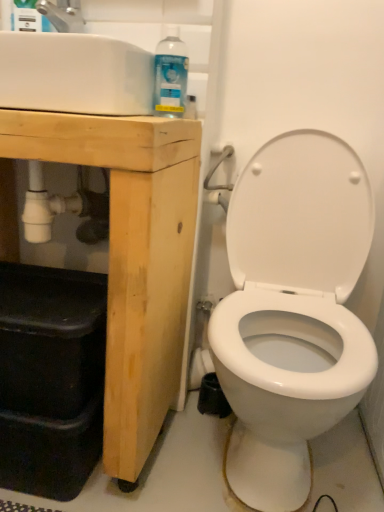
Question: From a real-world perspective, is brushed metal faucet at upper left positioned above or below natural wood cabinet at left?

Choices:
 (A) above
 (B) below

Answer: (A)

Question: Is brushed metal faucet at upper left to the left or to the right of natural wood cabinet at left in the image?

Choices:
 (A) right
 (B) left

Answer: (A)

Question: Which of these objects is positioned farthest from the brushed metal faucet at upper left?

Choices:
 (A) natural wood cabinet at left
 (B) white glossy sink at upper left
 (C) clear plastic spray bottle at upper left, which ranks as the first cleaning product in top-to-bottom order
 (D) clear plastic spray bottle at upper left, the second cleaning product positioned from the top

Answer: (A)

Question: Which is farther from the white glossy sink at upper left?

Choices:
 (A) brushed metal faucet at upper left
 (B) clear plastic spray bottle at upper left, which ranks as the first cleaning product in top-to-bottom order
 (C) natural wood cabinet at left
 (D) clear plastic spray bottle at upper left, marked as the 1th cleaning product in a right-to-left arrangement

Answer: (B)